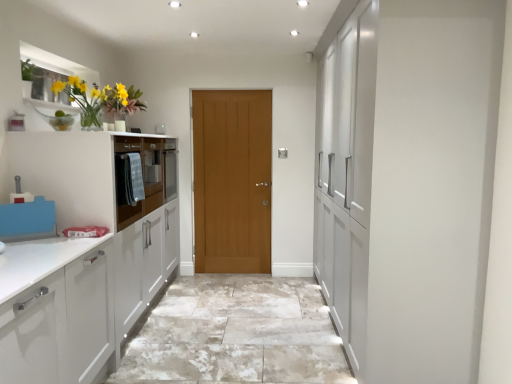
You are a GUI agent. You are given a task and a screenshot of the screen. Output one action in this format:
    pyautogui.click(x=<x>, y=<y>)
    Task: Click on the free space above natural stone floor at center (from a real-world perspective)
    The image size is (512, 384).
    Given the screenshot: What is the action you would take?
    pyautogui.click(x=253, y=309)